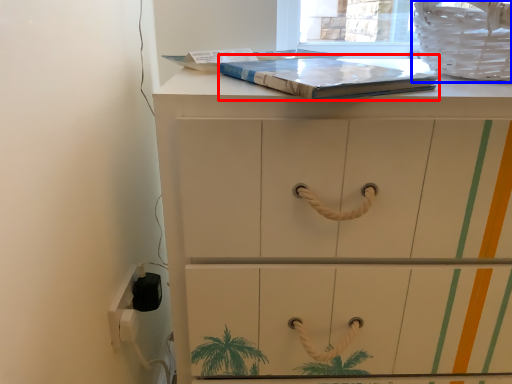
Question: Which point is closer to the camera, paperback book (highlighted by a red box) or laundry basket (highlighted by a blue box)?

Choices:
 (A) paperback book
 (B) laundry basket

Answer: (A)